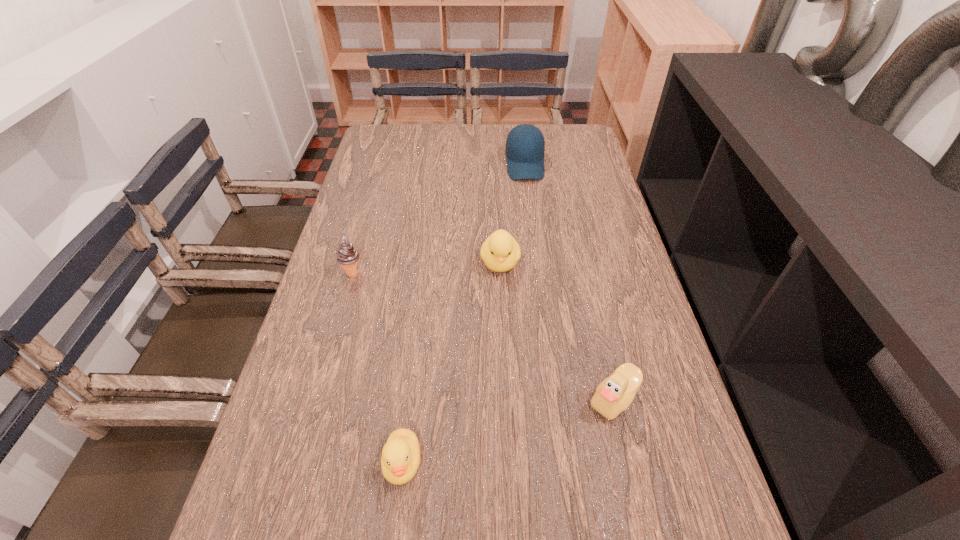
The image size is (960, 540). I want to click on blank region between the second duck from right to left and the fourth object from right to left, so click(451, 363).

The image size is (960, 540). I want to click on free space between the farthest object and the leftmost object, so click(439, 219).

You are a GUI agent. You are given a task and a screenshot of the screen. Output one action in this format:
    pyautogui.click(x=<x>, y=<y>)
    Task: Click on the free spot between the icecream and the farthest duck
    The image size is (960, 540).
    Given the screenshot: What is the action you would take?
    pyautogui.click(x=426, y=268)

Locate an element on the screen. The height and width of the screenshot is (540, 960). vacant area between the farthest object and the nearest object is located at coordinates (464, 314).

This screenshot has height=540, width=960. I want to click on empty location between the second nearest object and the farthest object, so [569, 282].

Locate an element on the screen. This screenshot has width=960, height=540. free space between the baseball cap and the icecream is located at coordinates (439, 219).

Locate an element on the screen. This screenshot has height=540, width=960. vacant region between the icecream and the farthest object is located at coordinates (439, 219).

You are a GUI agent. You are given a task and a screenshot of the screen. Output one action in this format:
    pyautogui.click(x=<x>, y=<y>)
    Task: Click on the free space that is in between the second nearest object and the farthest duck
    Image resolution: width=960 pixels, height=540 pixels.
    Given the screenshot: What is the action you would take?
    pyautogui.click(x=557, y=330)

Identify the location of vacant space that's between the icecream and the second duck from right to left. The image size is (960, 540). (426, 268).

Locate an element on the screen. free point between the second object from left to right and the farthest object is located at coordinates (464, 314).